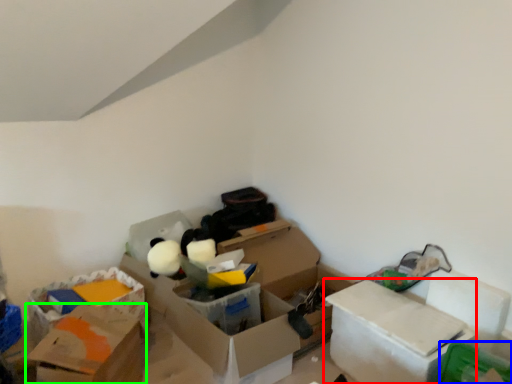
Question: Based on their relative distances, which object is farther from box (highlighted by a red box)? Choose from storage box (highlighted by a blue box) and box (highlighted by a green box).

Choices:
 (A) storage box
 (B) box

Answer: (B)